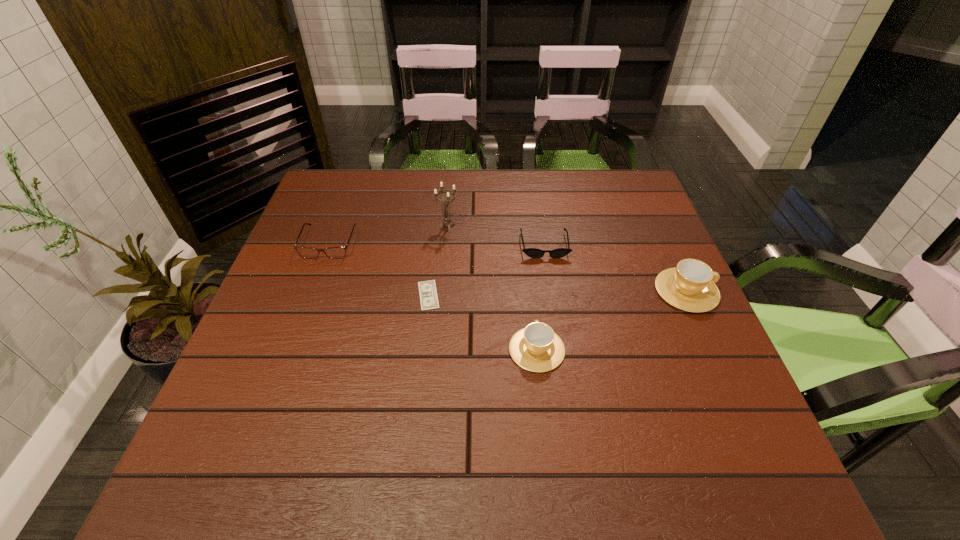
The cups are evenly distributed in the image. To maintain this, where would you place another cup on the left? Please point to a free space. Please provide its 2D coordinates. Your answer should be formatted as a tuple, i.e. [(x, y)], where the tuple contains the x and y coordinates of a point satisfying the conditions above.

[(343, 426)]